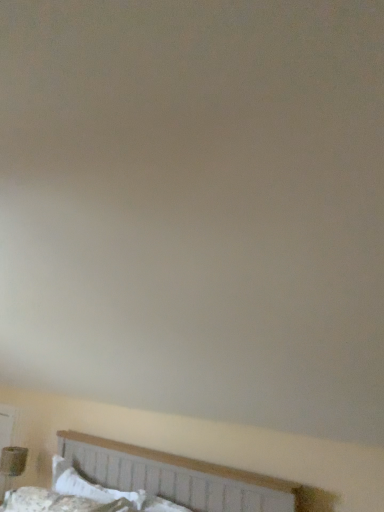
Question: Can you confirm if white fabric bed at lower center is positioned to the left of matte brown table lamp at lower left?

Choices:
 (A) no
 (B) yes

Answer: (A)

Question: Could you tell me if white fabric bed at lower center is turned towards matte brown table lamp at lower left?

Choices:
 (A) no
 (B) yes

Answer: (A)

Question: Can you confirm if white fabric bed at lower center is wider than matte brown table lamp at lower left?

Choices:
 (A) no
 (B) yes

Answer: (B)

Question: From a real-world perspective, is white fabric bed at lower center positioned over matte brown table lamp at lower left based on gravity?

Choices:
 (A) yes
 (B) no

Answer: (A)

Question: Can you confirm if white fabric bed at lower center is positioned to the right of matte brown table lamp at lower left?

Choices:
 (A) yes
 (B) no

Answer: (A)

Question: Does white fabric bed at lower center have a lesser height compared to matte brown table lamp at lower left?

Choices:
 (A) yes
 (B) no

Answer: (A)

Question: Is matte brown table lamp at lower left positioned far away from white cotton pillow at lower left?

Choices:
 (A) yes
 (B) no

Answer: (B)

Question: Can you see matte brown table lamp at lower left touching white cotton pillow at lower left?

Choices:
 (A) no
 (B) yes

Answer: (A)

Question: Does matte brown table lamp at lower left have a greater width compared to white cotton pillow at lower left?

Choices:
 (A) no
 (B) yes

Answer: (B)

Question: Does matte brown table lamp at lower left come in front of white cotton pillow at lower left?

Choices:
 (A) yes
 (B) no

Answer: (B)

Question: From a real-world perspective, does matte brown table lamp at lower left sit lower than white cotton pillow at lower left?

Choices:
 (A) no
 (B) yes

Answer: (B)

Question: Is matte brown table lamp at lower left positioned behind white cotton pillow at lower left?

Choices:
 (A) no
 (B) yes

Answer: (B)

Question: Is white cotton pillow at lower left located outside matte brown table lamp at lower left?

Choices:
 (A) yes
 (B) no

Answer: (A)